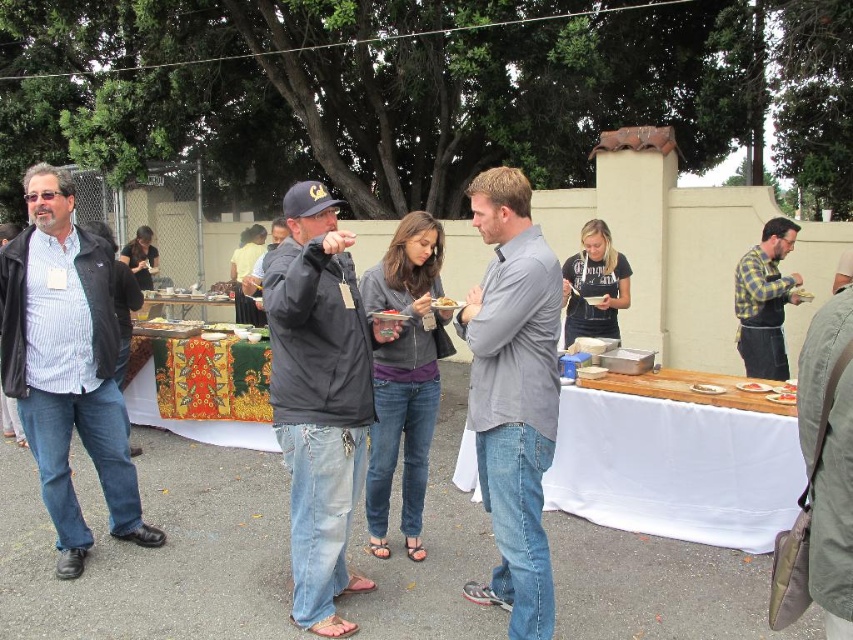
You are a guest at this buffet event and want to place your plate on the white cloth table at center and the golden crispy pastry at center. Which surface is more suitable for placing your plate?

The white cloth table at center has a larger size compared to the golden crispy pastry at center, so it is more suitable for placing your plate.

From the picture: You are standing at the point marked as point (527, 429) and want to hand a plate of food to the man in the dark jacket and baseball cap. Can you reach him without moving from your current position?

The distance between you and the man in the dark jacket and baseball cap is 2.84 meters. Since the average human arm length is about 0.7 meters, you cannot reach him without moving.

You are a photographer at the event and want to capture both the gray matte shirt at center and the checkered fabric shirt at right in the same photo. Which shirt should you focus on first to ensure both are in frame?

The gray matte shirt at center is below the checkered fabric shirt at right, so focusing on the checkered fabric shirt at right first will allow the photographer to include both in the frame as the gray matte shirt at center is positioned lower.